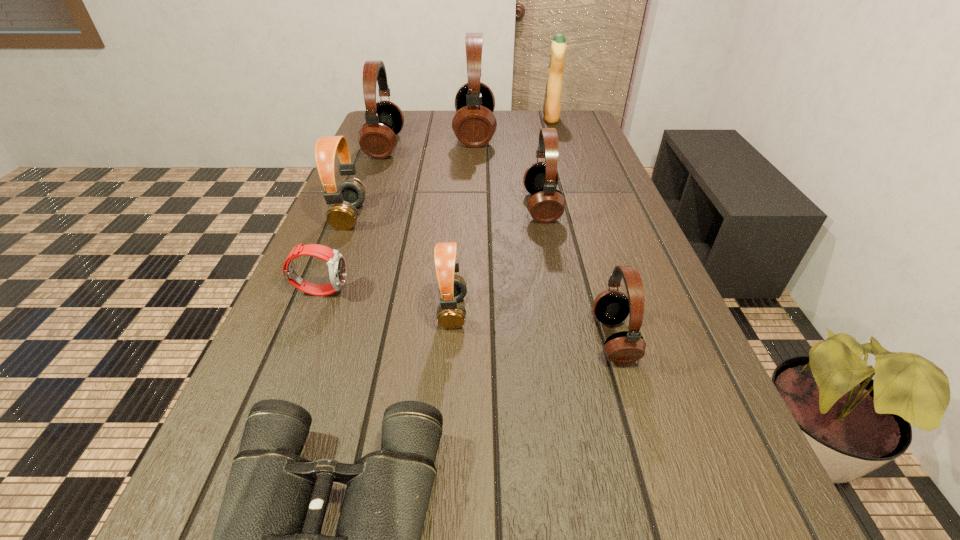
Locate an element on the screen. the right brown headset is located at coordinates (452, 288).

This screenshot has height=540, width=960. I want to click on the nearest black headset, so click(611, 307).

The height and width of the screenshot is (540, 960). Identify the location of the smallest black headset. (611, 307).

Identify the location of watch. The height and width of the screenshot is (540, 960). (336, 262).

Find the location of a particular element. The width and height of the screenshot is (960, 540). red watch is located at coordinates (336, 262).

Locate an element on the screen. free location located on the ear pads of the second black headset from left to right is located at coordinates (552, 133).

Identify the location of free space located on the label of the detergent. (501, 118).

You are a GUI agent. You are given a task and a screenshot of the screen. Output one action in this format:
    pyautogui.click(x=<x>, y=<y>)
    Task: Click on the vacant space situated 0.160m on the label of the detergent
    This screenshot has width=960, height=540.
    Given the screenshot: What is the action you would take?
    pyautogui.click(x=498, y=118)

Image resolution: width=960 pixels, height=540 pixels. What are the coordinates of `blank space located on the label of the detergent` in the screenshot? It's located at (443, 118).

Locate an element on the screen. vacant point located on the ear pads of the third smallest black headset is located at coordinates (527, 146).